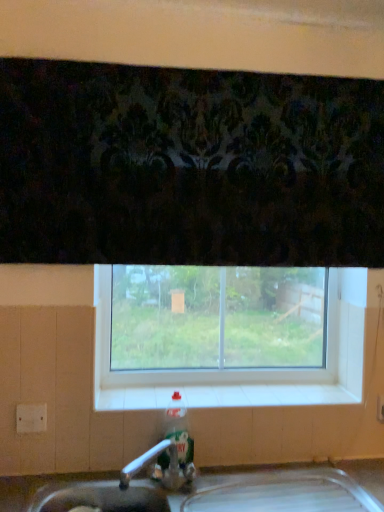
Question: From the image's perspective, is clear glass window at center below translucent plastic bottle at sink?

Choices:
 (A) no
 (B) yes

Answer: (A)

Question: Considering the relative sizes of clear glass window at center and translucent plastic bottle at sink in the image provided, is clear glass window at center shorter than translucent plastic bottle at sink?

Choices:
 (A) no
 (B) yes

Answer: (A)

Question: Is clear glass window at center to the left of translucent plastic bottle at sink from the viewer's perspective?

Choices:
 (A) no
 (B) yes

Answer: (A)

Question: Does clear glass window at center lie in front of translucent plastic bottle at sink?

Choices:
 (A) yes
 (B) no

Answer: (B)

Question: Considering the relative sizes of clear glass window at center and translucent plastic bottle at sink in the image provided, is clear glass window at center taller than translucent plastic bottle at sink?

Choices:
 (A) no
 (B) yes

Answer: (B)

Question: Would you say clear glass window at center is outside translucent plastic bottle at sink?

Choices:
 (A) yes
 (B) no

Answer: (A)

Question: Considering the relative sizes of translucent plastic bottle at sink and clear glass window at center in the image provided, is translucent plastic bottle at sink bigger than clear glass window at center?

Choices:
 (A) yes
 (B) no

Answer: (B)

Question: Does translucent plastic bottle at sink have a smaller size compared to clear glass window at center?

Choices:
 (A) yes
 (B) no

Answer: (A)

Question: Is translucent plastic bottle at sink to the left of clear glass window at center from the viewer's perspective?

Choices:
 (A) no
 (B) yes

Answer: (B)

Question: Can you see translucent plastic bottle at sink touching clear glass window at center?

Choices:
 (A) no
 (B) yes

Answer: (A)

Question: Could you tell me if translucent plastic bottle at sink is facing clear glass window at center?

Choices:
 (A) no
 (B) yes

Answer: (A)

Question: Are translucent plastic bottle at sink and clear glass window at center far apart?

Choices:
 (A) yes
 (B) no

Answer: (B)

Question: Does white tile at center lie in front of clear glass window at center?

Choices:
 (A) yes
 (B) no

Answer: (A)